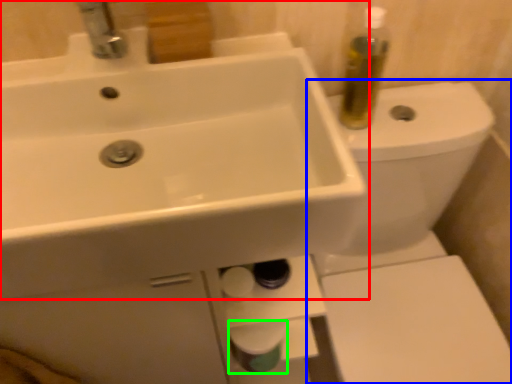
Question: Which object is positioned farthest from sink (highlighted by a red box)? Select from toilet (highlighted by a blue box) and toilet paper (highlighted by a green box).

Choices:
 (A) toilet
 (B) toilet paper

Answer: (A)